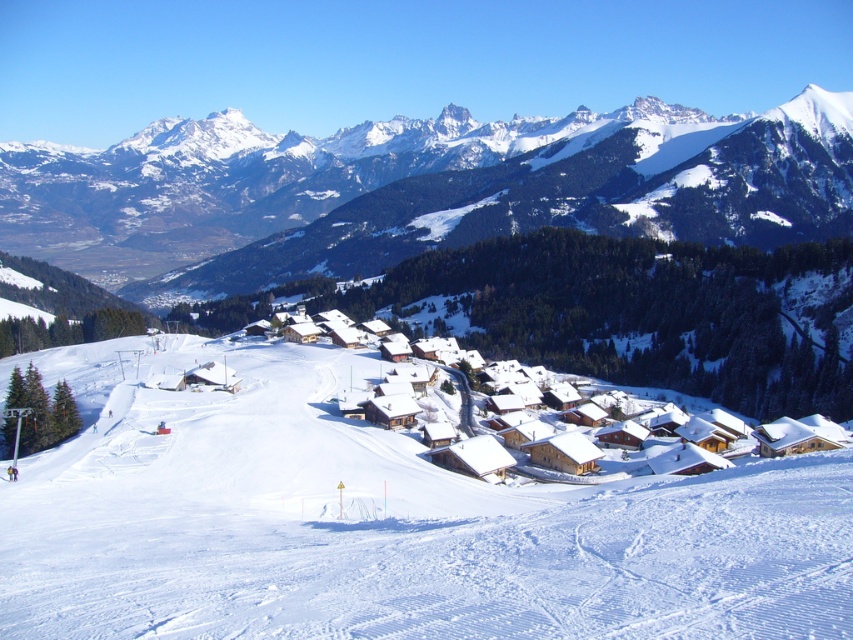
Can you confirm if snowy rocky mountain range at upper center is wider than wooden chalet at center?

Yes.

Between snowy rocky mountain range at upper center and wooden chalet at center, which one has more height?

Result: Standing taller between the two is snowy rocky mountain range at upper center.

At what (x,y) coordinates should I click in order to perform the action: click on snowy rocky mountain range at upper center. Please return your answer as a coordinate pair (x, y). Looking at the image, I should click on (416, 189).

Where is `snowy rocky mountain range at upper center`? The image size is (853, 640). snowy rocky mountain range at upper center is located at coordinates (416, 189).

Is the position of white snow ski slope at center more distant than that of wooden chalet at center?

That is False.

Is white snow ski slope at center thinner than wooden chalet at center?

Yes.

Describe the element at coordinates (386, 524) in the screenshot. I see `white snow ski slope at center` at that location.

Where is `white snow ski slope at center`? white snow ski slope at center is located at coordinates (386, 524).

Does white snow ski slope at center appear on the left side of snowy rocky mountain range at upper center?

Incorrect, white snow ski slope at center is not on the left side of snowy rocky mountain range at upper center.

Can you confirm if white snow ski slope at center is taller than snowy rocky mountain range at upper center?

No.

Where is `white snow ski slope at center`? The height and width of the screenshot is (640, 853). white snow ski slope at center is located at coordinates (386, 524).